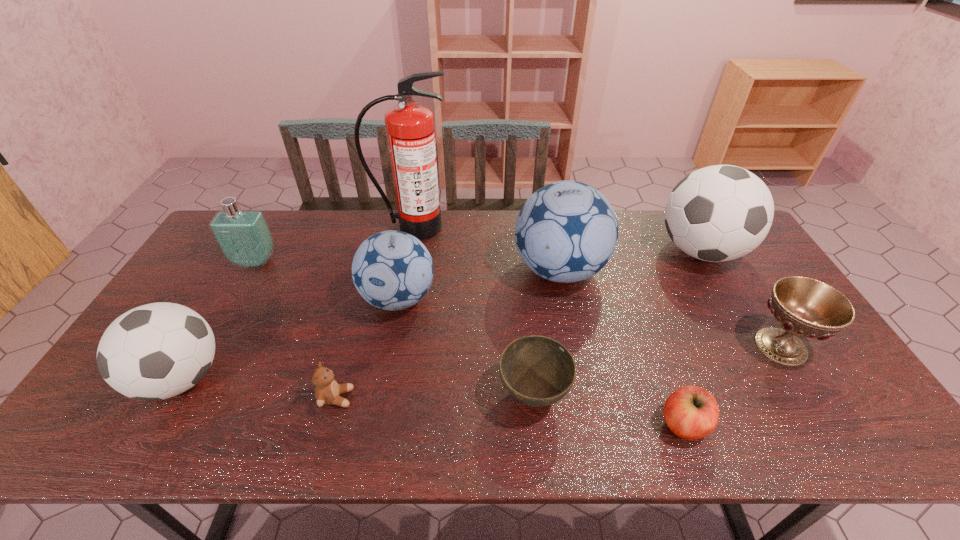
Find the location of `free space that satisfies the following two spatial constraints: 1. on the front-facing side of the red fire extinguisher; 2. on the right side of the third object from right to left`. free space that satisfies the following two spatial constraints: 1. on the front-facing side of the red fire extinguisher; 2. on the right side of the third object from right to left is located at coordinates (375, 424).

Where is `free spot that satisfies the following two spatial constraints: 1. on the front-facing side of the fire extinguisher; 2. on the right side of the rightmost soccer ball`? This screenshot has height=540, width=960. free spot that satisfies the following two spatial constraints: 1. on the front-facing side of the fire extinguisher; 2. on the right side of the rightmost soccer ball is located at coordinates (407, 251).

The width and height of the screenshot is (960, 540). I want to click on vacant space that satisfies the following two spatial constraints: 1. on the back side of the fourth shortest object; 2. on the left side of the left black soccer ball, so click(x=200, y=346).

Find the location of a particular element. The image size is (960, 540). free point that satisfies the following two spatial constraints: 1. on the side with brand of the third soccer ball from left to right; 2. on the left side of the apple is located at coordinates (589, 424).